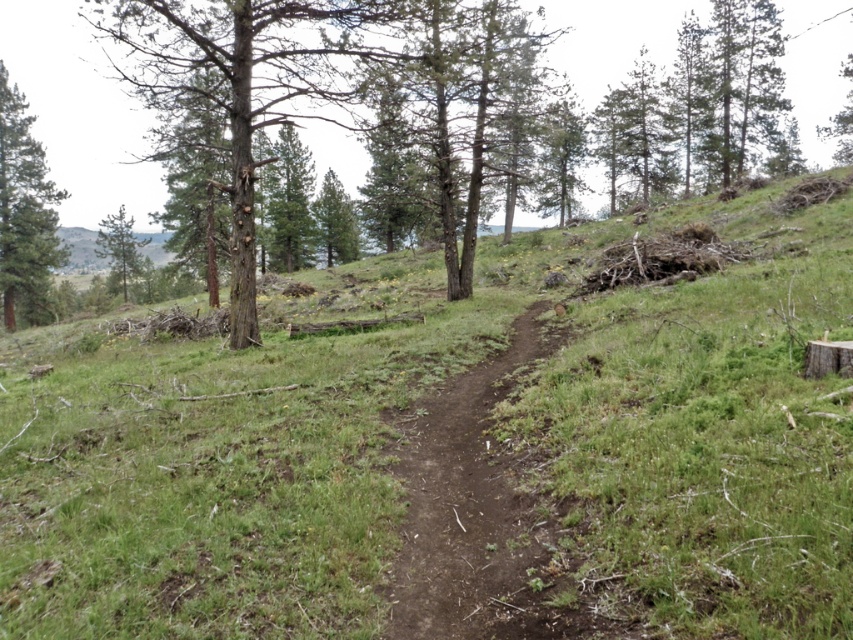
Question: Does green grassy at center appear on the right side of brown dirt track at center?

Choices:
 (A) yes
 (B) no

Answer: (A)

Question: Estimate the real-world distances between objects in this image. Which object is closer to the green textured pine tree at left?

Choices:
 (A) green grassy at center
 (B) green matte tree at upper left
 (C) brown dirt track at center

Answer: (B)

Question: Among these objects, which one is farthest from the camera?

Choices:
 (A) green rough bark tree at center
 (B) brown dirt track at center
 (C) green textured pine tree at left
 (D) green matte tree at upper left

Answer: (D)

Question: Is green grassy at center in front of green matte tree at upper left?

Choices:
 (A) yes
 (B) no

Answer: (A)

Question: Is green rough bark tree at center positioned behind green textured pine tree at left?

Choices:
 (A) yes
 (B) no

Answer: (B)

Question: Which point is closer to the camera taking this photo?

Choices:
 (A) (6, 401)
 (B) (26, 216)
 (C) (450, 256)
 (D) (99, 243)

Answer: (A)